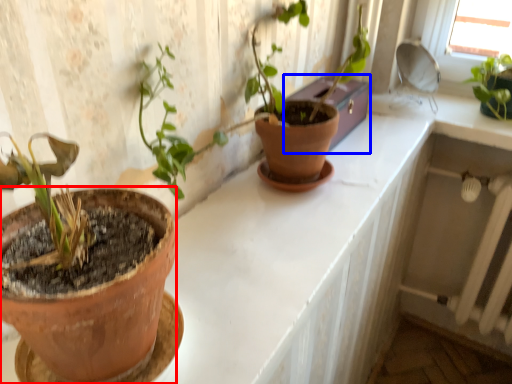
Question: Among these objects, which one is nearest to the camera, flowerpot (highlighted by a red box) or window box (highlighted by a blue box)?

Choices:
 (A) flowerpot
 (B) window box

Answer: (A)